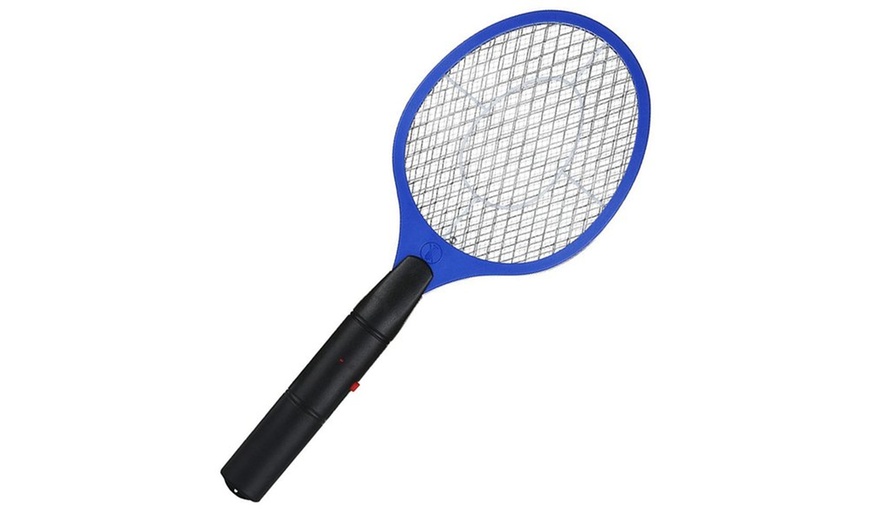
Locate an element on the screen. small red power indicator light is located at coordinates (340, 360).